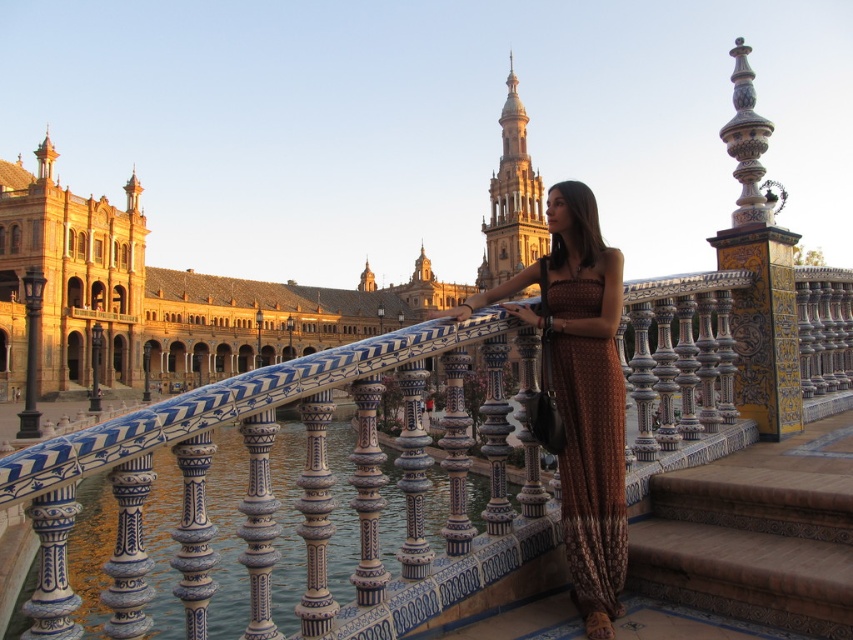
Question: Which object is closer to the camera taking this photo?

Choices:
 (A) blue and white ceramic rail at center
 (B) brown textured dress at center
 (C) brown woven dress at center

Answer: (A)

Question: Is blue and white ceramic rail at center above brown woven dress at center?

Choices:
 (A) no
 (B) yes

Answer: (A)

Question: Considering the real-world distances, which object is closest to the brown textured dress at center?

Choices:
 (A) blue and white ceramic rail at center
 (B) brown woven dress at center

Answer: (B)

Question: Is blue and white ceramic rail at center wider than brown textured dress at center?

Choices:
 (A) no
 (B) yes

Answer: (B)

Question: Considering the real-world distances, which object is closest to the blue and white ceramic rail at center?

Choices:
 (A) brown textured dress at center
 (B) brown woven dress at center

Answer: (A)

Question: Is blue and white ceramic rail at center positioned at the back of brown textured dress at center?

Choices:
 (A) yes
 (B) no

Answer: (B)